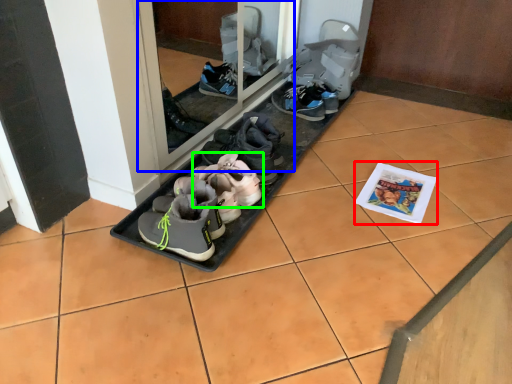
Question: Estimate the real-world distances between objects in this image. Which object is farther from magazine (highlighted by a red box), glass door (highlighted by a blue box) or footwear (highlighted by a green box)?

Choices:
 (A) glass door
 (B) footwear

Answer: (A)